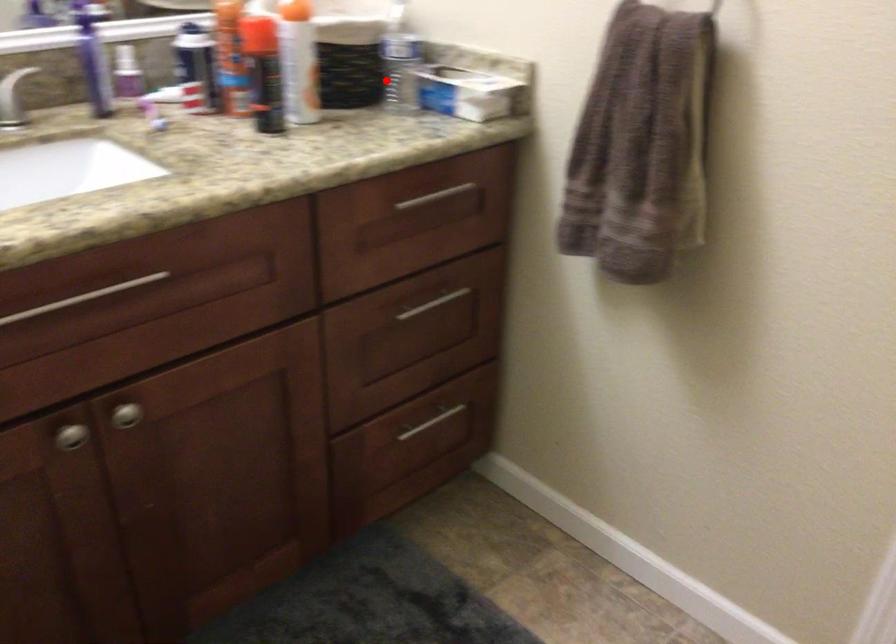
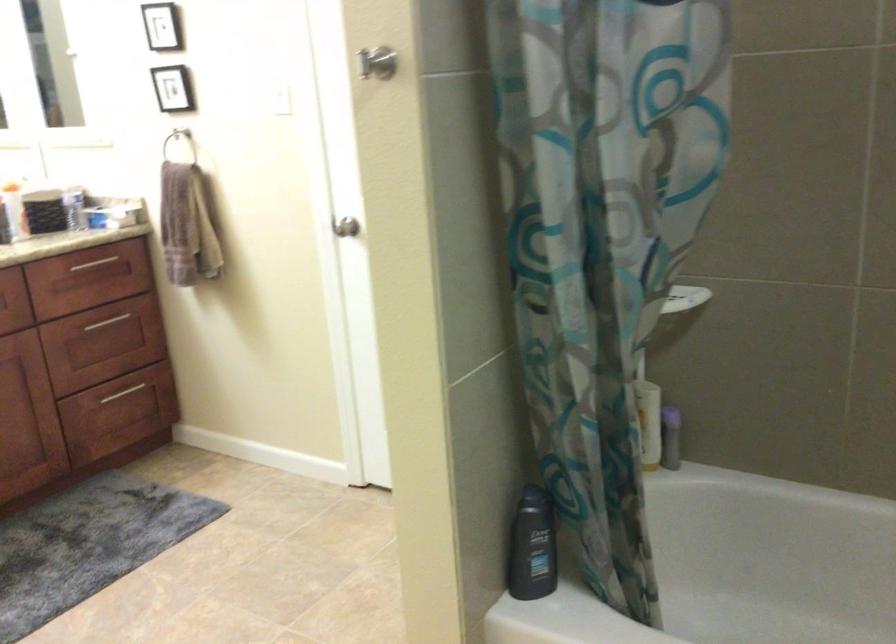
Question: I am providing you with two images of the same scene from different viewpoints. Given a red point in image1, look at the same physical point in image2. Is it:

Choices:
 (A) Closer to the viewpoint
 (B) Farther from the viewpoint

Answer: (B)